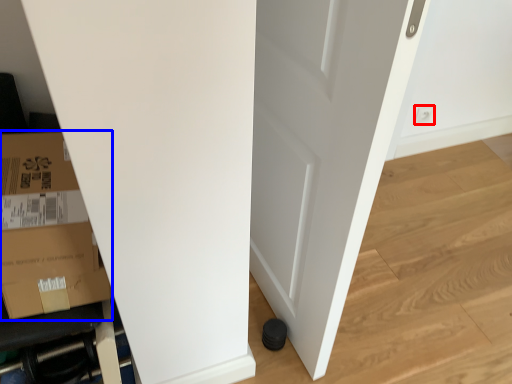
Question: Which point is closer to the camera, electric outlet (highlighted by a red box) or cardboard box (highlighted by a blue box)?

Choices:
 (A) electric outlet
 (B) cardboard box

Answer: (B)